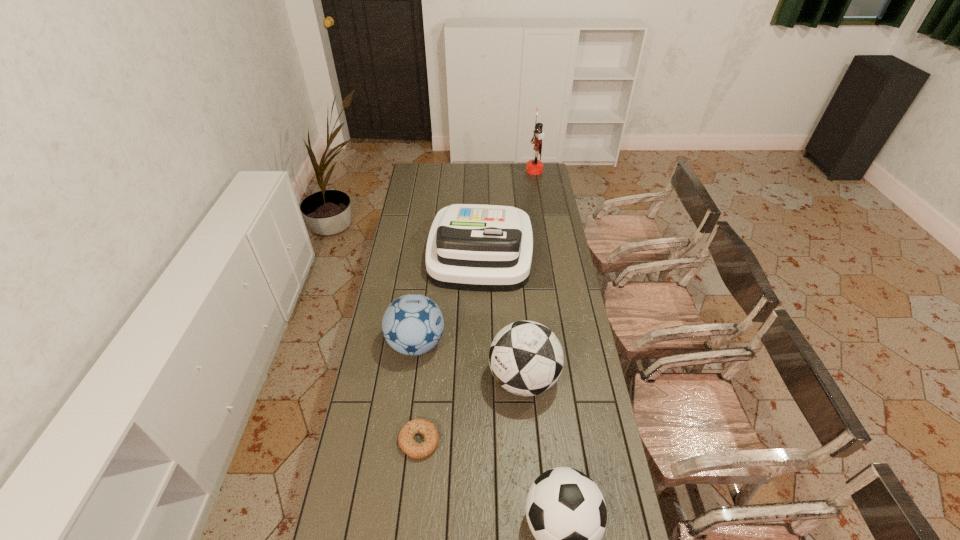
Find the location of a particular element. This screenshot has height=540, width=960. free space located 0.200m on the side with brand of the leftmost soccer ball is located at coordinates (495, 343).

Locate an element on the screen. vacant position located 0.120m on the right of the fifth farthest object is located at coordinates (475, 441).

Find the location of `object at the far edge`. object at the far edge is located at coordinates (535, 166).

Identify the location of soccer ball present at the left edge. (413, 324).

I want to click on bagel positioned at the left edge, so click(x=408, y=445).

Where is `nutcracker that is at the right edge`? This screenshot has width=960, height=540. nutcracker that is at the right edge is located at coordinates (535, 166).

Locate an element on the screen. The width and height of the screenshot is (960, 540). soccer ball present at the right edge is located at coordinates (526, 358).

The image size is (960, 540). I want to click on object present at the far right corner, so click(535, 166).

Identify the location of vacant region at the far edge of the desktop. (475, 168).

Where is `free location at the left edge of the desktop`? This screenshot has width=960, height=540. free location at the left edge of the desktop is located at coordinates (431, 194).